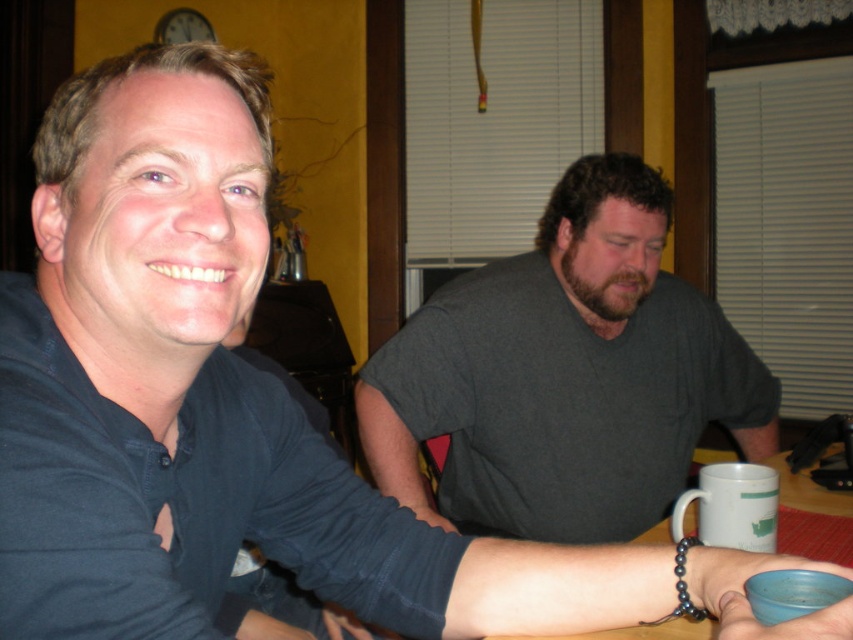
You are a barista preparing drinks and need to place the gray matte shirt at center and the white matte mug at lower right on a shelf. The shelf has limited space, and you want to ensure both items fit without overlapping. Which item should you place first to maximize space efficiency?

The gray matte shirt at center is larger in size compared to the white matte mug at lower right. To maximize space efficiency, place the larger gray matte shirt at center first, then position the smaller white matte mug at lower right next to it.

Looking at this image, you are standing 3 feet away from the table where two people are sitting. There is a point at coordinates point (x=718, y=529). Can you reach that point without moving closer to the table?

The distance between point (x=718, y=529) and the viewer is 3.47 feet. Since you are currently 3 feet away from the table, you are 0.47 feet closer than the required distance to reach the point. Therefore, you can reach the point without moving closer.